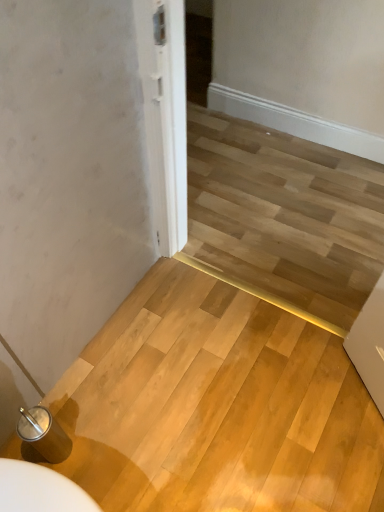
This screenshot has height=512, width=384. In order to click on wooden stairwell at lower left in this screenshot , I will do `click(215, 407)`.

Measure the distance between point (164, 478) and camera.

A distance of 4.36 feet exists between point (164, 478) and camera.

In order to face wooden stairwell at lower left, should I rotate leftwards or rightwards?

You should look right and rotate roughly 4.056 degrees.

Describe the element at coordinates (215, 407) in the screenshot. I see `wooden stairwell at lower left` at that location.

Where is `wooden stairwell at lower left`? wooden stairwell at lower left is located at coordinates (215, 407).